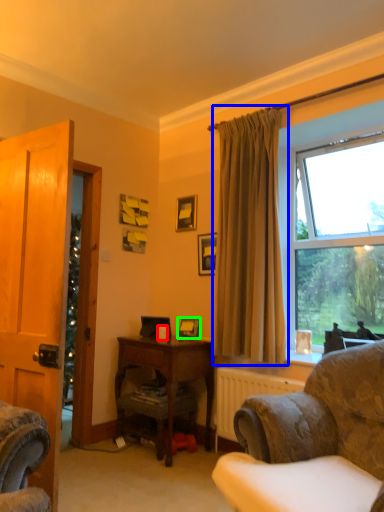
Question: Considering the real-world distances, which object is closest to coffee cup (highlighted by a red box)? curtain (highlighted by a blue box) or picture frame (highlighted by a green box).

Choices:
 (A) curtain
 (B) picture frame

Answer: (B)